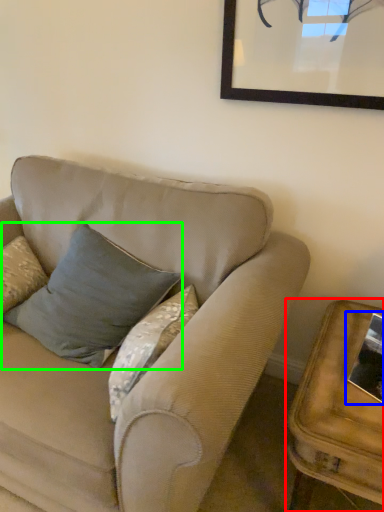
Question: Estimate the real-world distances between objects in this image. Which object is farther from table (highlighted by a red box), picture frame (highlighted by a blue box) or pillow (highlighted by a green box)?

Choices:
 (A) picture frame
 (B) pillow

Answer: (B)